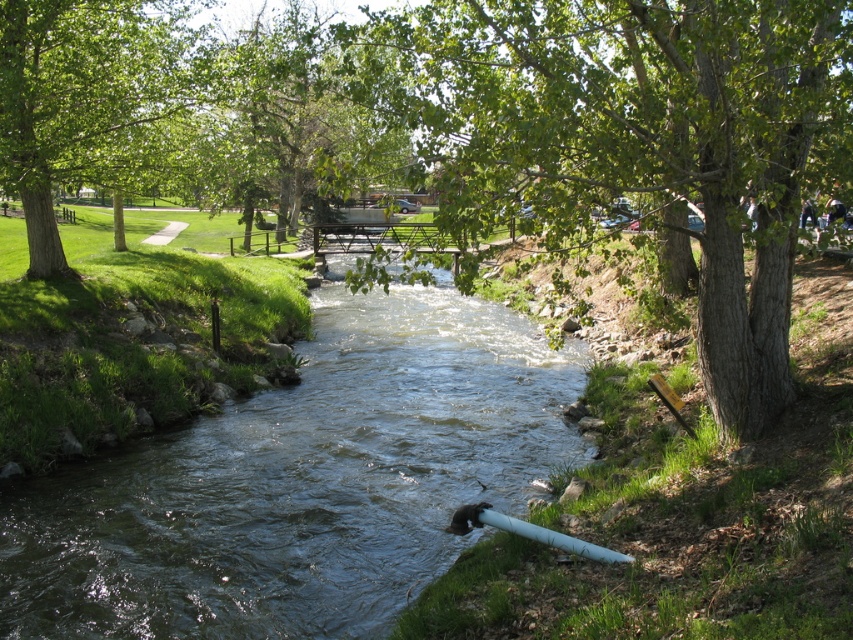
You are planning to cross the stream using a 2 meter wide raft. You see the clear water at center and the green leafy tree at center. Which object should you avoid to safely navigate your raft?

The clear water at center might be wider than the green leafy tree at center, so you should avoid the green leafy tree at center as it may obstruct the path.

You are standing at the edge of the stream and want to walk towards the green leafy tree at center. Which direction should you turn to avoid the green leafy tree at upper left?

You should turn to your right to avoid the green leafy tree at upper left and head towards the green leafy tree at center since the green leafy tree at center is to the right of the green leafy tree at upper left.

You are standing at the edge of the stream and want to cross to the other side. The clear water at center and the green leafy tree at center are in your path. Which one do you need to step over or around?

The clear water at center has a smaller size compared to the green leafy tree at center, so you need to step over the clear water at center since it is smaller and more manageable to cross, while the green leafy tree at center is larger and likely cannot be stepped over easily.